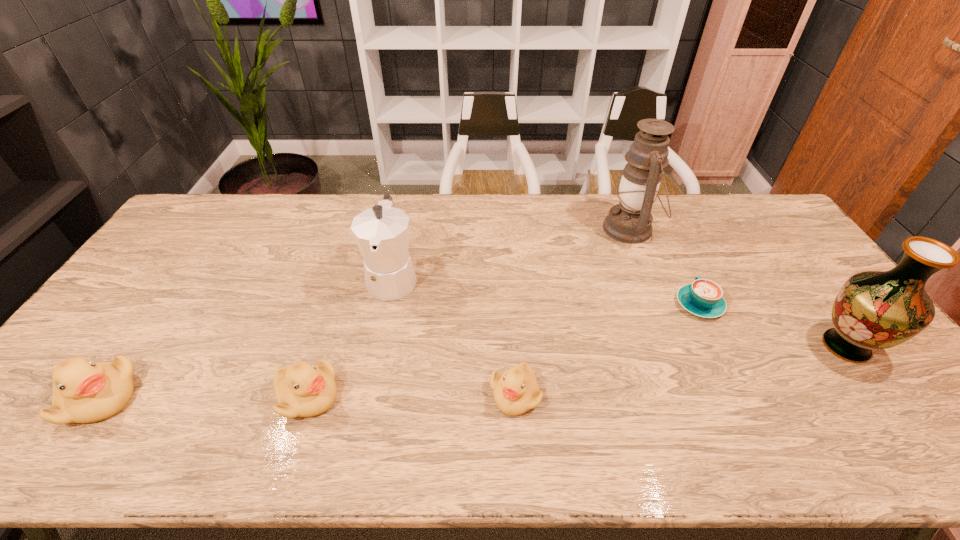
The height and width of the screenshot is (540, 960). What are the coordinates of `the leftmost duckling` in the screenshot? It's located at (84, 391).

Identify the location of the third shortest object. (302, 390).

You are a GUI agent. You are given a task and a screenshot of the screen. Output one action in this format:
    pyautogui.click(x=<x>, y=<y>)
    Task: Click on the second duckling from right to left
    
    Given the screenshot: What is the action you would take?
    pyautogui.click(x=302, y=390)

The width and height of the screenshot is (960, 540). In order to click on the fourth object from right to left in this screenshot , I will do `click(516, 391)`.

Locate an element on the screen. Image resolution: width=960 pixels, height=540 pixels. the shortest duckling is located at coordinates (516, 391).

Identify the location of oil lamp. The width and height of the screenshot is (960, 540). (630, 221).

You are a GUI agent. You are given a task and a screenshot of the screen. Output one action in this format:
    pyautogui.click(x=<x>, y=<y>)
    Task: Click on the cappuccino
    The image size is (960, 540).
    Given the screenshot: What is the action you would take?
    pyautogui.click(x=703, y=297)

At what (x,y) coordinates should I click in order to perform the action: click on coffeepot. Please return your answer as a coordinate pair (x, y). The height and width of the screenshot is (540, 960). Looking at the image, I should click on (382, 232).

Where is `vase`? The height and width of the screenshot is (540, 960). vase is located at coordinates (875, 310).

Where is `the rightmost object`? The width and height of the screenshot is (960, 540). the rightmost object is located at coordinates (875, 310).